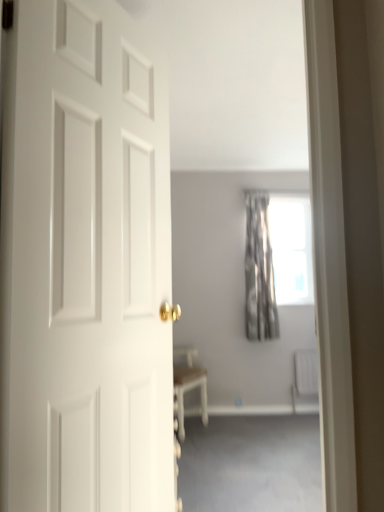
Question: From the image's perspective, is white plastic radiator at lower right under white matte door at left?

Choices:
 (A) yes
 (B) no

Answer: (A)

Question: Considering the relative sizes of white plastic radiator at lower right and white matte door at left in the image provided, is white plastic radiator at lower right thinner than white matte door at left?

Choices:
 (A) no
 (B) yes

Answer: (B)

Question: Is white plastic radiator at lower right facing towards white matte door at left?

Choices:
 (A) yes
 (B) no

Answer: (B)

Question: From the image's perspective, is white plastic radiator at lower right on top of white matte door at left?

Choices:
 (A) yes
 (B) no

Answer: (B)

Question: Is white plastic radiator at lower right far from white matte door at left?

Choices:
 (A) no
 (B) yes

Answer: (B)

Question: From the image's perspective, is white matte door at left located above or below white plastic radiator at lower right?

Choices:
 (A) below
 (B) above

Answer: (B)

Question: In terms of height, does white matte door at left look taller or shorter compared to white plastic radiator at lower right?

Choices:
 (A) tall
 (B) short

Answer: (A)

Question: Considering the positions of white matte door at left and white plastic radiator at lower right in the image, is white matte door at left bigger or smaller than white plastic radiator at lower right?

Choices:
 (A) big
 (B) small

Answer: (A)

Question: Is white matte door at left to the left or to the right of white plastic radiator at lower right in the image?

Choices:
 (A) right
 (B) left

Answer: (B)

Question: From the image's perspective, is gray fabric curtain at upper center positioned above or below white matte door at left?

Choices:
 (A) below
 (B) above

Answer: (A)

Question: Choose the correct answer: Is gray fabric curtain at upper center inside white matte door at left or outside it?

Choices:
 (A) outside
 (B) inside

Answer: (A)

Question: From a real-world perspective, relative to white matte door at left, is gray fabric curtain at upper center vertically above or below?

Choices:
 (A) below
 (B) above

Answer: (A)

Question: Is gray fabric curtain at upper center bigger or smaller than white matte door at left?

Choices:
 (A) small
 (B) big

Answer: (A)

Question: Is point (261, 252) positioned closer to the camera than point (299, 381)?

Choices:
 (A) farther
 (B) closer

Answer: (B)

Question: In the image, is silvery metallic curtain at center on the left side or the right side of white plastic radiator at lower right?

Choices:
 (A) left
 (B) right

Answer: (A)